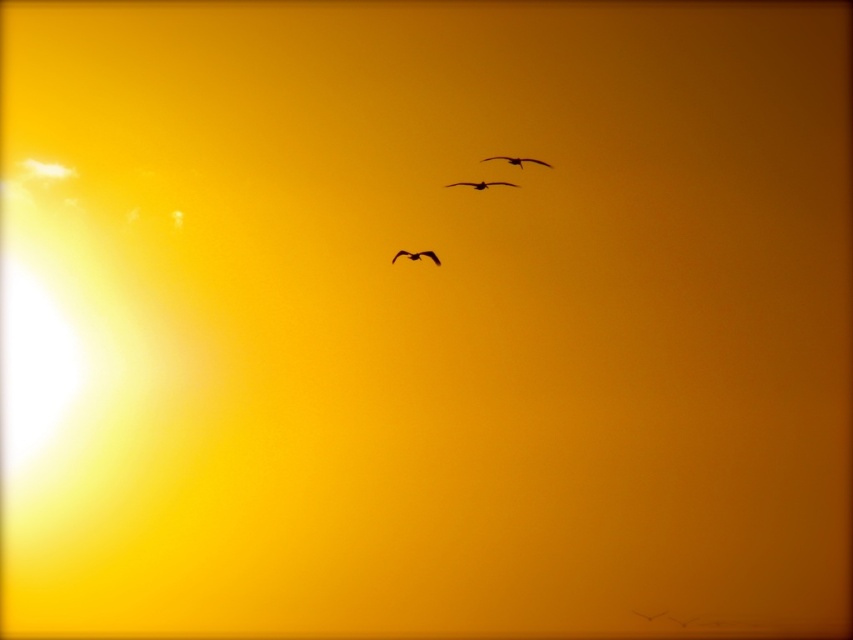
Question: Which point is closer to the camera taking this photo?

Choices:
 (A) (448, 184)
 (B) (416, 256)
 (C) (527, 157)

Answer: (A)

Question: Does black matte bird at upper center have a larger size compared to black matte bird at center?

Choices:
 (A) yes
 (B) no

Answer: (B)

Question: Observing the image, what is the correct spatial positioning of black matte bird at upper center in reference to black matte bird at center?

Choices:
 (A) below
 (B) above

Answer: (B)

Question: Estimate the real-world distances between objects in this image. Which object is farther from the black matte bird at upper center?

Choices:
 (A) dark brown feathered bird at center
 (B) black matte bird at center

Answer: (B)

Question: Does black matte bird at upper center appear under black matte bird at center?

Choices:
 (A) yes
 (B) no

Answer: (B)

Question: Which object is the closest to the black matte bird at center?

Choices:
 (A) black matte bird at upper center
 (B) dark brown feathered bird at center

Answer: (B)